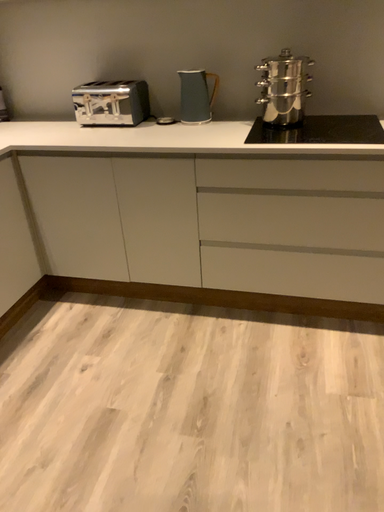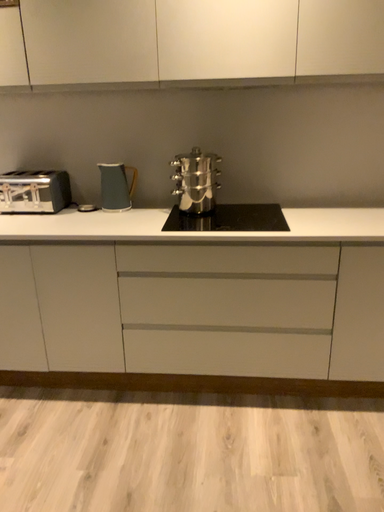
Question: How did the camera likely rotate when shooting the video?

Choices:
 (A) rotated left
 (B) rotated right

Answer: (B)